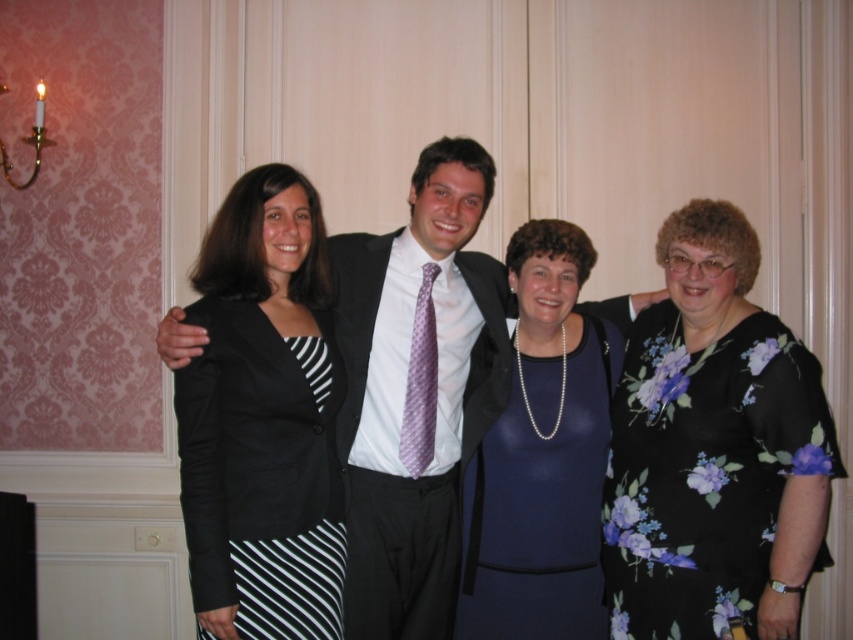
Question: Which object appears farthest from the camera in this image?

Choices:
 (A) matte black suit at center
 (B) floral print dress at right
 (C) black striped skirt at left

Answer: (A)

Question: Is matte black suit at center to the left of black striped skirt at left from the viewer's perspective?

Choices:
 (A) no
 (B) yes

Answer: (A)

Question: Does matte black suit at center have a greater width compared to blue satin dress at center?

Choices:
 (A) yes
 (B) no

Answer: (B)

Question: Which point is farther from the camera taking this photo?

Choices:
 (A) (x=712, y=417)
 (B) (x=485, y=518)

Answer: (B)

Question: From the image, what is the correct spatial relationship of matte black suit at center in relation to blue satin dress at center?

Choices:
 (A) below
 (B) above

Answer: (B)

Question: Estimate the real-world distances between objects in this image. Which object is closer to the matte black suit at center?

Choices:
 (A) black striped skirt at left
 (B) blue satin dress at center
 (C) floral print dress at right

Answer: (B)